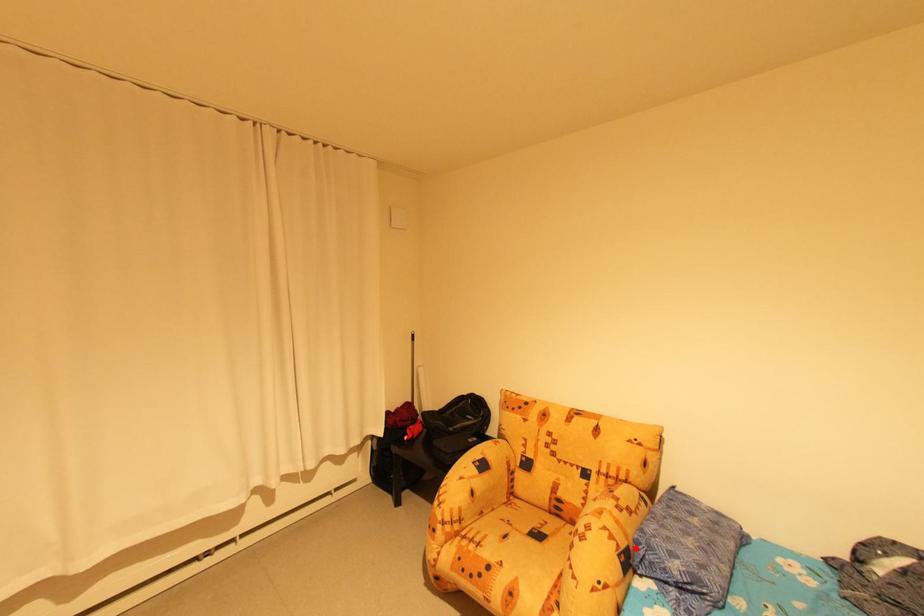
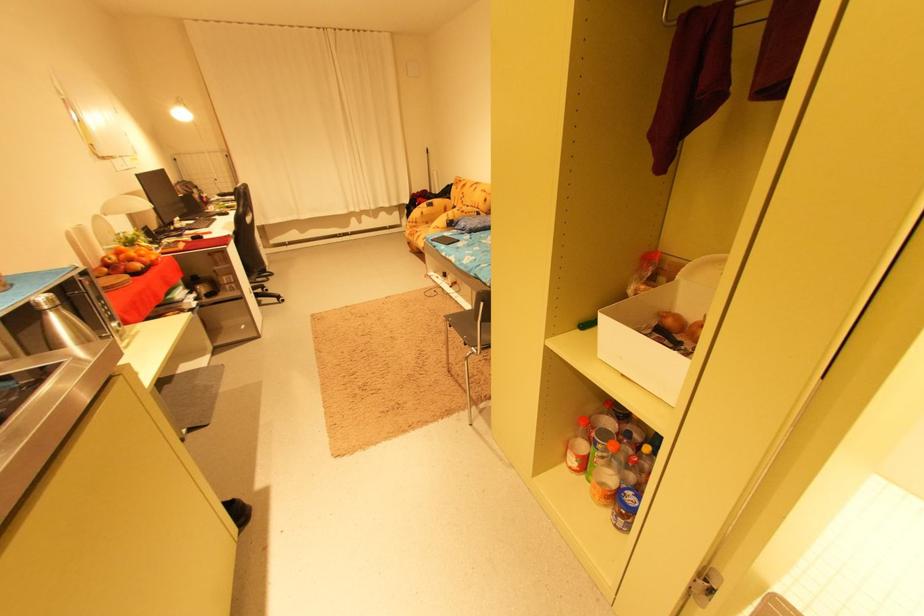
Question: I am providing you with two images of the same scene from different viewpoints. In image1, a red point is highlighted. Considering the same 3D point in image2, which of the following is correct?

Choices:
 (A) It is closer
 (B) It is farther

Answer: (A)